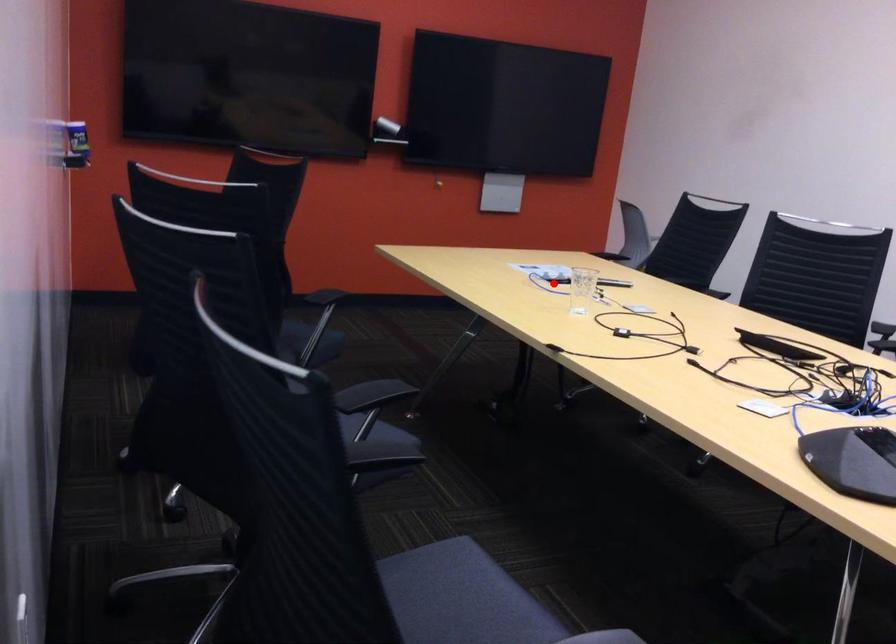
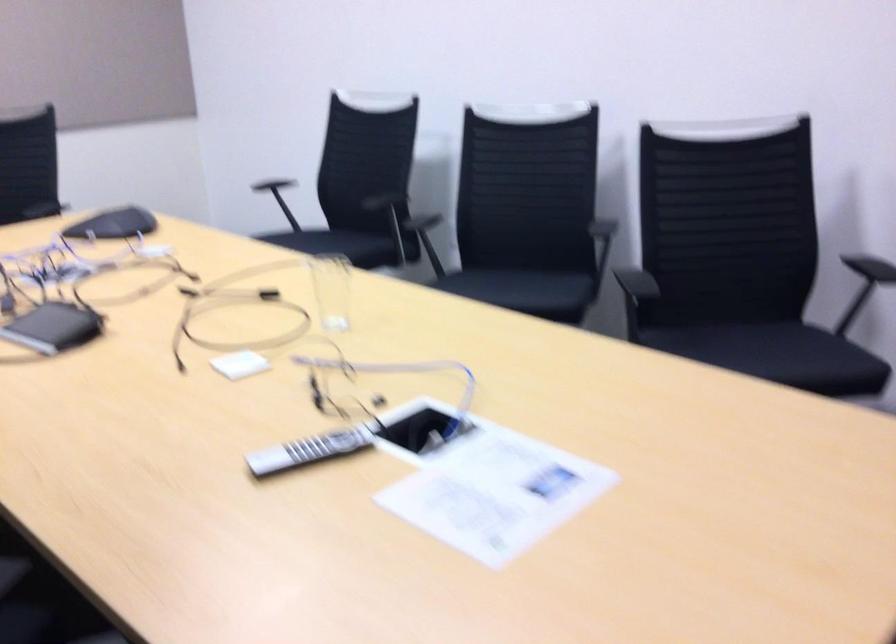
In the second image, find the point that corresponds to the highlighted location in the first image.

(419, 430)